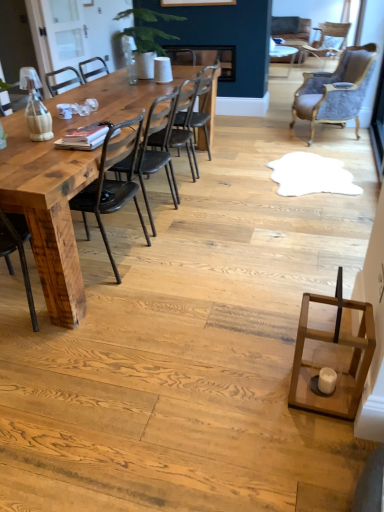
Question: In the image, is rustic wood chair at left, which ranks as the fifth chair in right-to-left order, positioned in front of or behind black leather chair at center, the third chair in the left-to-right sequence?

Choices:
 (A) behind
 (B) front

Answer: (B)

Question: From a real-world perspective, relative to black leather chair at center, which is the third chair in right-to-left order, is rustic wood chair at left, marked as the fifth chair in a back-to-front arrangement, vertically above or below?

Choices:
 (A) above
 (B) below

Answer: (B)

Question: Which of these objects is positioned closest to the rustic wood chair at left, marked as the fifth chair in a back-to-front arrangement?

Choices:
 (A) velvet grey armchair at upper right, the second chair when ordered from top to bottom
 (B) metallic black chair at center, the fourth chair positioned from the right
 (C) black leather chair at center, arranged as the 3th chair when ordered from the bottom
 (D) natural wood table at left
 (E) wooden chair at upper right, the fifth chair positioned from the bottom

Answer: (B)

Question: Estimate the real-world distances between objects in this image. Which object is closer to the velvet grey armchair at upper right, arranged as the fourth chair when viewed from the front?

Choices:
 (A) rustic wood chair at left, placed as the first chair when sorted from left to right
 (B) wooden chair at upper right, arranged as the 5th chair when viewed from the front
 (C) metallic black chair at center, the fourth chair positioned from the back
 (D) natural wood table at left
 (E) black leather chair at center, arranged as the 3th chair when ordered from the bottom

Answer: (E)